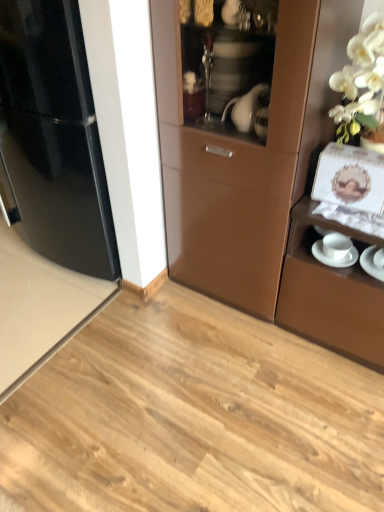
Question: From the image's perspective, is glossy black refrigerator at left positioned above or below white glossy saucer at right, which ranks as the 1th saucer in left-to-right order?

Choices:
 (A) above
 (B) below

Answer: (A)

Question: Is glossy black refrigerator at left spatially inside white glossy saucer at right, which is the second saucer from right to left, or outside of it?

Choices:
 (A) outside
 (B) inside

Answer: (A)

Question: Based on their relative distances, which object is farther from the white glossy saucer at right, which ranks as the 1th saucer in left-to-right order?

Choices:
 (A) glossy black refrigerator at left
 (B) white glossy saucer at lower right, the first saucer in the right-to-left sequence

Answer: (A)

Question: Which object is the closest to the glossy black refrigerator at left?

Choices:
 (A) white glossy saucer at right, which is the second saucer from right to left
 (B) white glossy saucer at lower right, the first saucer in the right-to-left sequence

Answer: (A)